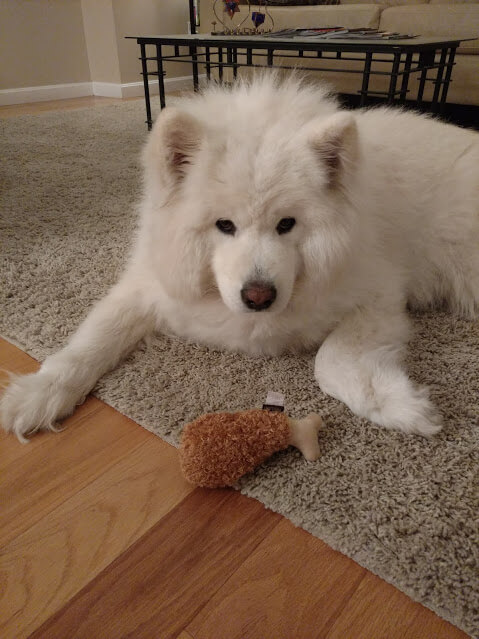
Find the location of a particular element. The image size is (479, 639). light tan shaggy rug is located at coordinates (68, 273).